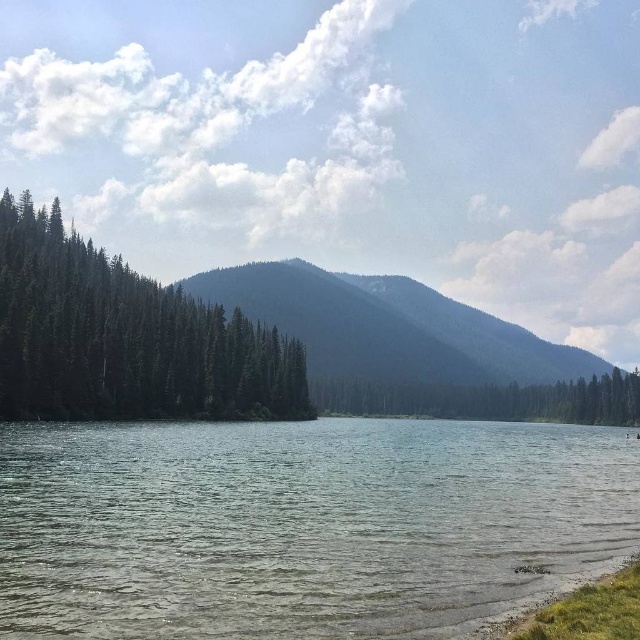
You are standing at the center of the image and want to walk towards the clear water at lower center. According to the coordinates provided, in which direction should you move?

The clear water at lower center is located at coordinates point (301, 524), so you should move towards the lower right direction to reach it.